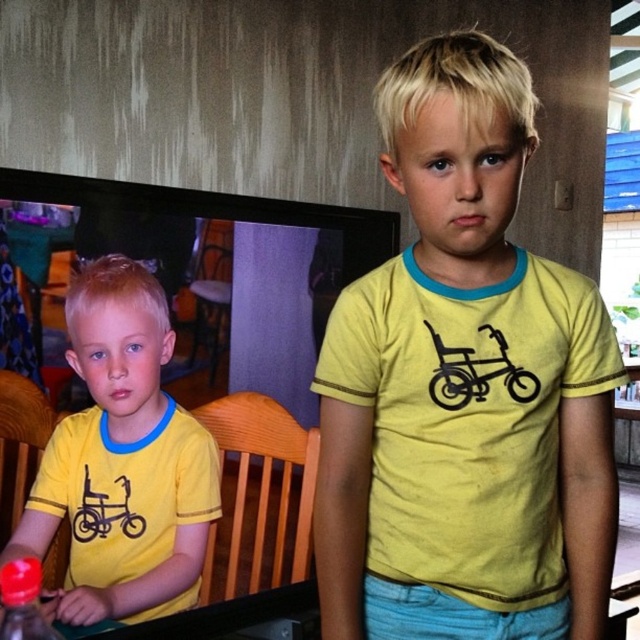
You are a photographer trying to capture a closeup of the yellow matte shirt at center. Given that your camera can focus on objects between 20 to 30 inches away, will you be able to take the photo without moving the shirt?

The yellow matte shirt at center is 29.34 inches away from the camera, which falls within the focus range of 20 to 30 inches. Therefore, you can take the photo without moving the shirt.